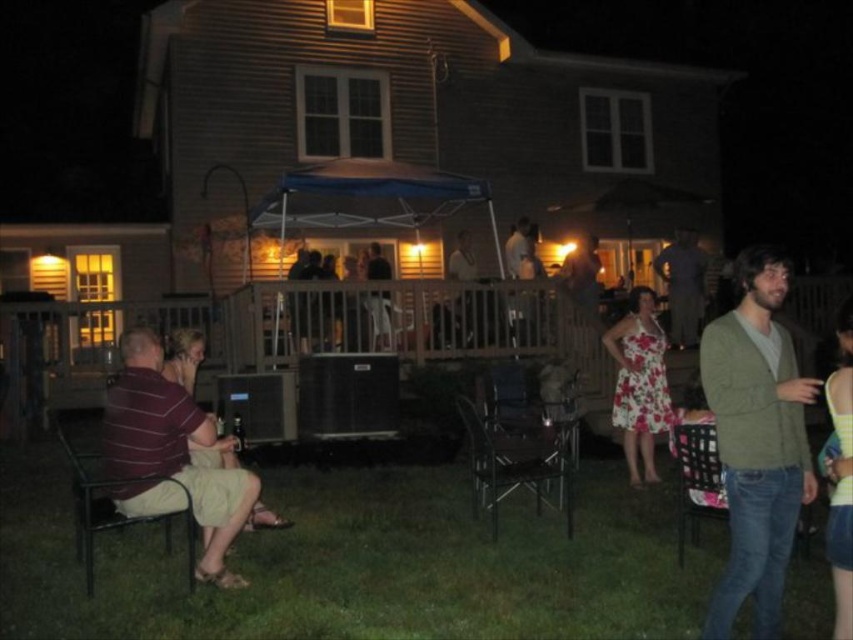
Does green sweater at right appear over metallic silver chair at center?

Yes.

Does green sweater at right have a smaller size compared to metallic silver chair at center?

Yes.

Where is `green sweater at right`? The width and height of the screenshot is (853, 640). green sweater at right is located at coordinates (x=756, y=440).

Locate an element on the screen. The height and width of the screenshot is (640, 853). green sweater at right is located at coordinates (756, 440).

Is green sweater at right thinner than metallic black chair at lower left?

Yes.

Who is positioned more to the left, green sweater at right or metallic black chair at lower left?

From the viewer's perspective, metallic black chair at lower left appears more on the left side.

Is point (773, 560) closer to viewer compared to point (187, 550)?

Yes, point (773, 560) is in front of point (187, 550).

Find the location of a particular element. Image resolution: width=853 pixels, height=640 pixels. green sweater at right is located at coordinates (756, 440).

Is wooden deck at center positioned before green sweater at right?

No, wooden deck at center is behind green sweater at right.

Is wooden deck at center below green sweater at right?

Incorrect, wooden deck at center is not positioned below green sweater at right.

Between point (524, 308) and point (764, 348), which one is positioned in front?

Point (764, 348) is more forward.

At what (x,y) coordinates should I click in order to perform the action: click on wooden deck at center. Please return your answer as a coordinate pair (x, y). The width and height of the screenshot is (853, 640). Looking at the image, I should click on (291, 332).